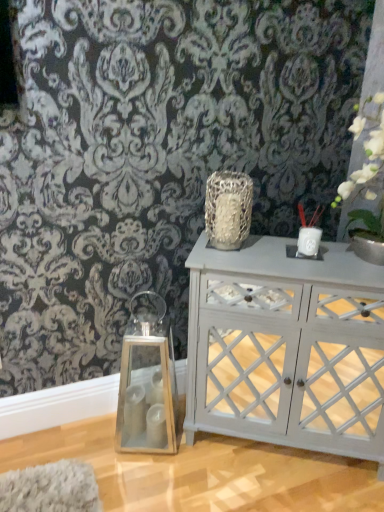
Image resolution: width=384 pixels, height=512 pixels. What are the coordinates of `vacant area that is in front of textured silver vase at center` in the screenshot? It's located at click(x=231, y=262).